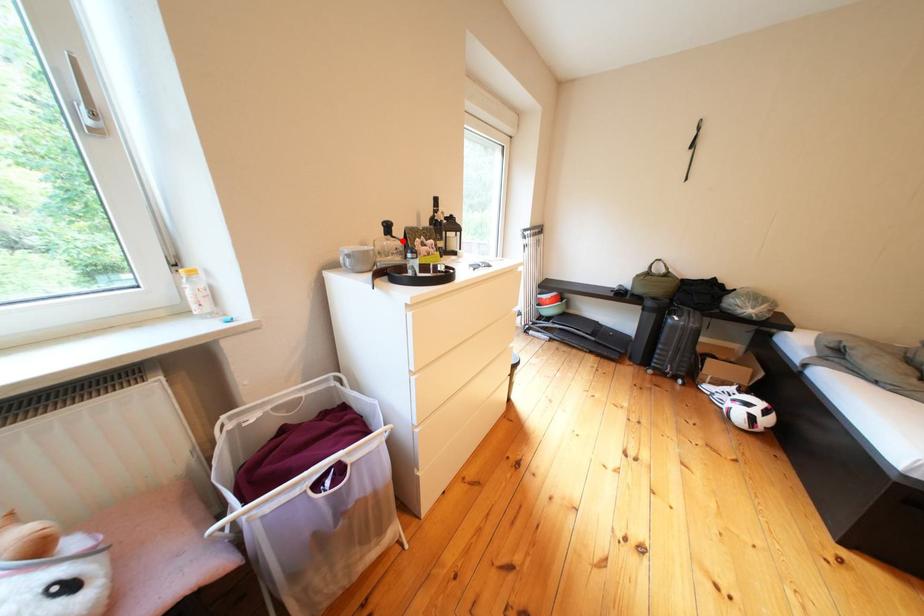
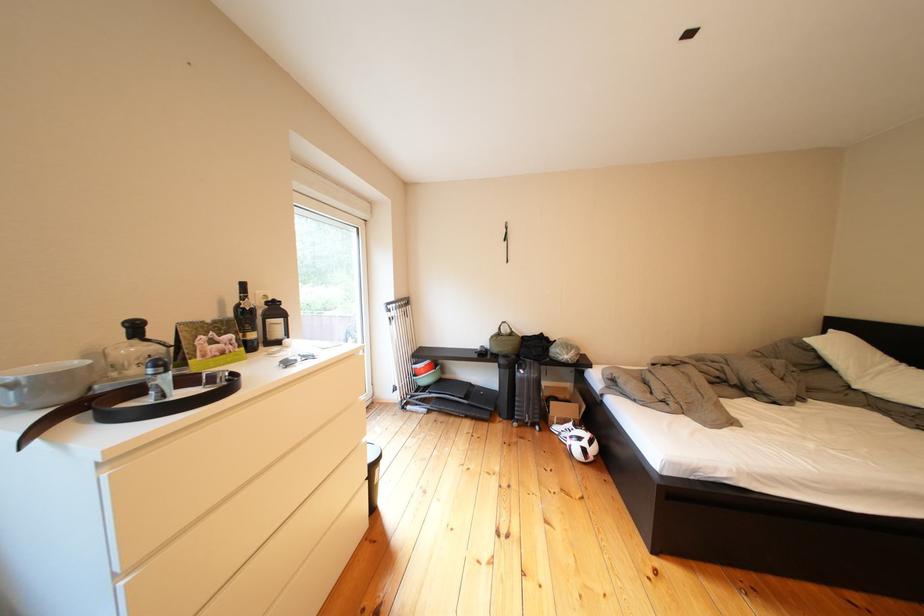
Locate, in the second image, the point that corresponds to the highlighted location in the first image.

(150, 345)